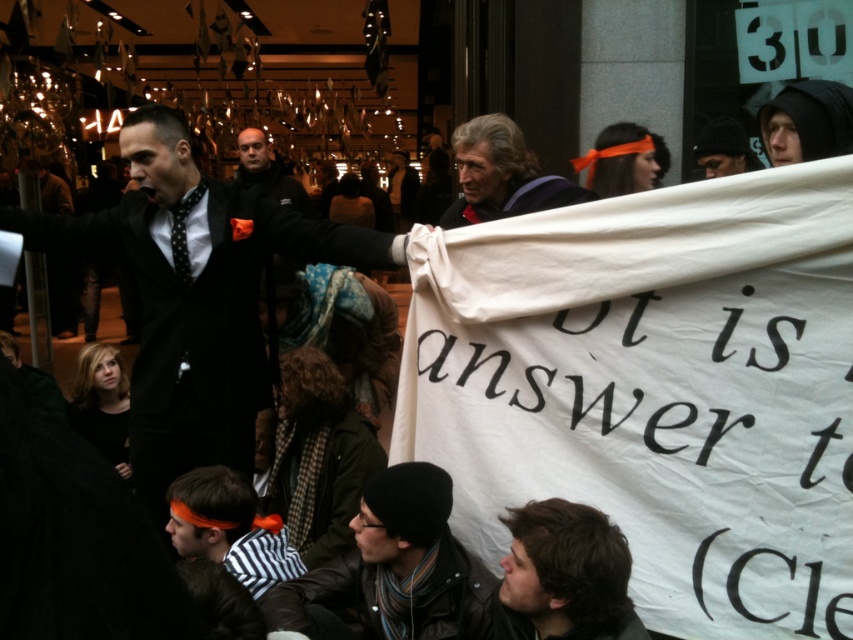
You are a photographer trying to capture a clear shot of the banner. You notice two people in your frame, one with dark brown hair at lower right and another wearing a dark gray jacket at center. Which person is closer to the camera?

The dark brown hair at lower right is not as tall as the dark gray jacket at center, so the dark brown hair at lower right is closer to the camera.